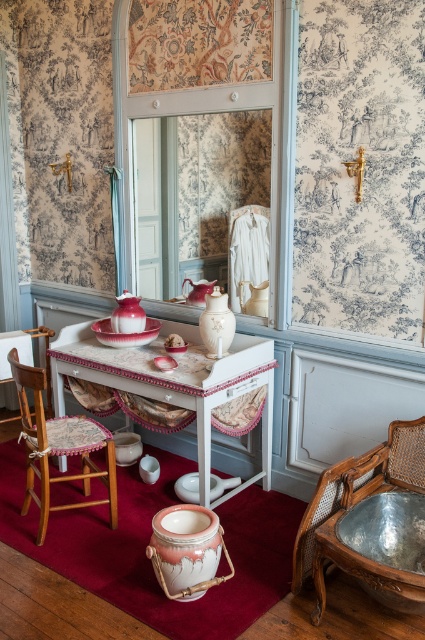
Can you confirm if wooden cane armchair at lower right is positioned above wooden chair with cushion at left?

Incorrect, wooden cane armchair at lower right is not positioned above wooden chair with cushion at left.

Does wooden cane armchair at lower right appear under wooden chair with cushion at left?

Yes.

Is point (416, 428) behind point (53, 451)?

No, (416, 428) is closer to viewer.

This screenshot has width=425, height=640. I want to click on wooden cane armchair at lower right, so click(x=354, y=502).

Looking at this image, is white glossy vanity at center positioned before wooden cane armchair at lower right?

No, white glossy vanity at center is behind wooden cane armchair at lower right.

Does white glossy vanity at center have a lesser height compared to wooden cane armchair at lower right?

In fact, white glossy vanity at center may be taller than wooden cane armchair at lower right.

Describe the element at coordinates (175, 380) in the screenshot. Image resolution: width=425 pixels, height=640 pixels. I see `white glossy vanity at center` at that location.

The width and height of the screenshot is (425, 640). Find the location of `white glossy vanity at center`. white glossy vanity at center is located at coordinates (175, 380).

Is white glossy vanity at center thinner than wooden chair with cushion at left?

No, white glossy vanity at center is not thinner than wooden chair with cushion at left.

Which is more to the right, white glossy vanity at center or wooden chair with cushion at left?

white glossy vanity at center

Which is in front, point (263, 376) or point (42, 486)?

Point (42, 486) is in front.

In order to click on white glossy vanity at center in this screenshot , I will do `click(175, 380)`.